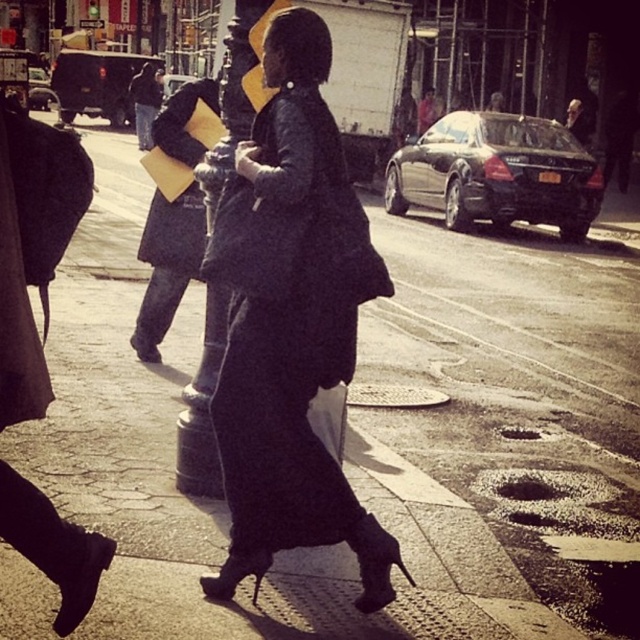
Question: Which point is closer to the camera taking this photo?

Choices:
 (A) (312, 244)
 (B) (170, 212)

Answer: (A)

Question: Can you confirm if black matte robe at center is positioned above matte black coat at center?

Choices:
 (A) yes
 (B) no

Answer: (B)

Question: Is black matte robe at center smaller than matte black coat at center?

Choices:
 (A) yes
 (B) no

Answer: (A)

Question: Is black matte robe at center closer to camera compared to matte black coat at center?

Choices:
 (A) no
 (B) yes

Answer: (B)